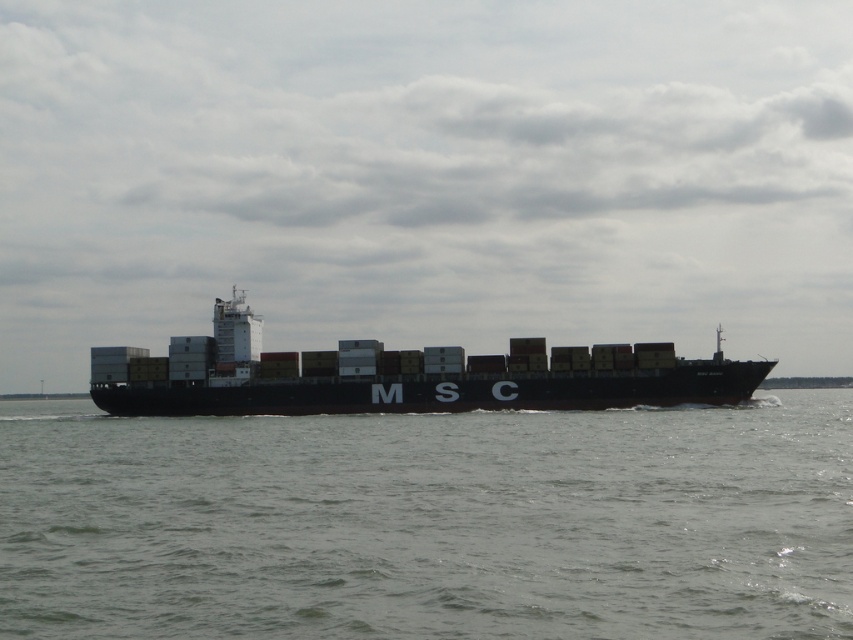
Question: Is gray matte water at center to the right of black matte container ship at center from the viewer's perspective?

Choices:
 (A) yes
 (B) no

Answer: (A)

Question: Does gray matte water at center have a larger size compared to black matte container ship at center?

Choices:
 (A) yes
 (B) no

Answer: (B)

Question: Is gray matte water at center positioned before black matte container ship at center?

Choices:
 (A) yes
 (B) no

Answer: (A)

Question: Which point is farther from the camera taking this photo?

Choices:
 (A) (364, 627)
 (B) (331, 381)

Answer: (B)